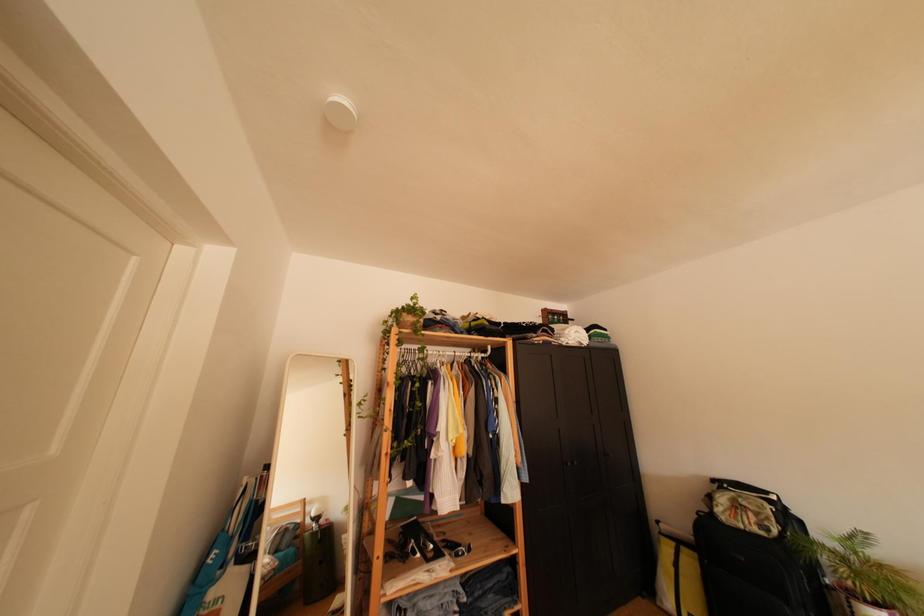
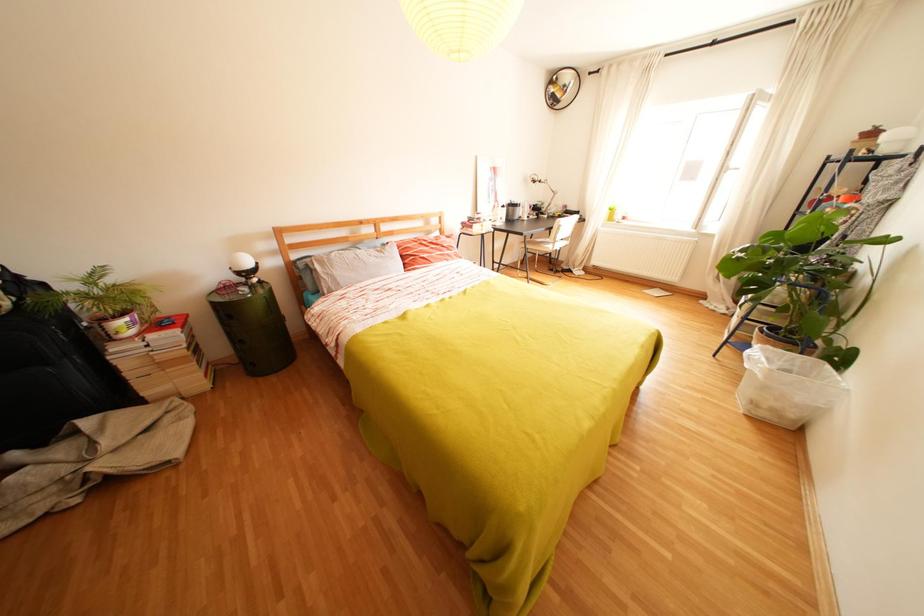
The images are taken continuously from a first-person perspective. In which direction is your viewpoint rotating?

The rotation direction of the camera is right-down.